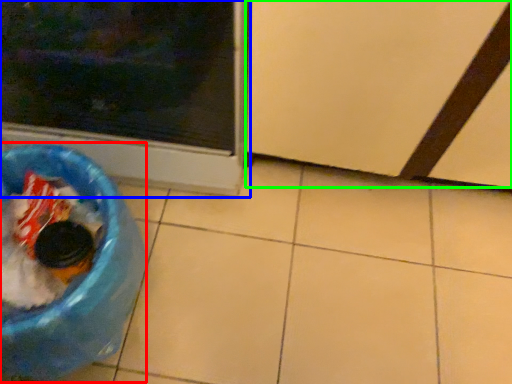
Question: Estimate the real-world distances between objects in this image. Which object is closer to recycling bin (highlighted by a red box), home appliance (highlighted by a blue box) or screen door (highlighted by a green box)?

Choices:
 (A) home appliance
 (B) screen door

Answer: (A)